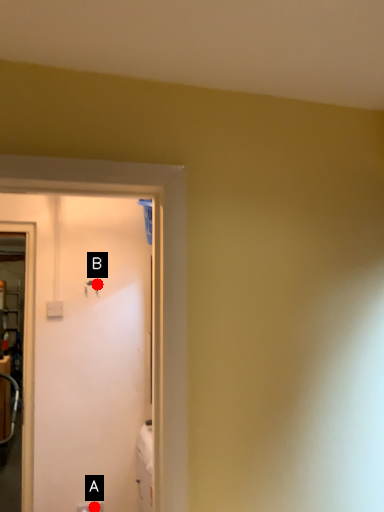
Question: Two points are circled on the image, labeled by A and B beside each circle. Which point is closer to the camera taking this photo?

Choices:
 (A) A is closer
 (B) B is closer

Answer: (A)